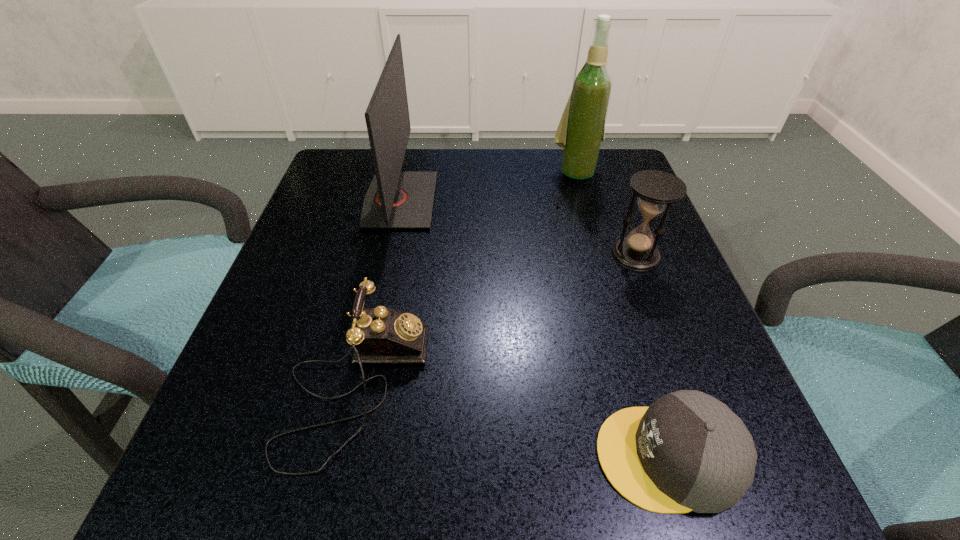
This screenshot has height=540, width=960. I want to click on free space located 0.050m on the front-facing side of the cap, so click(559, 456).

Locate an element on the screen. This screenshot has height=540, width=960. vacant space located 0.140m on the front-facing side of the cap is located at coordinates (489, 456).

This screenshot has height=540, width=960. Identify the location of wine bottle that is at the far edge. (581, 130).

The width and height of the screenshot is (960, 540). Find the location of `monitor that is at the far edge`. monitor that is at the far edge is located at coordinates [396, 199].

The width and height of the screenshot is (960, 540). I want to click on telephone present at the near edge, so click(380, 335).

Where is `cap situated at the near edge`? cap situated at the near edge is located at coordinates (687, 451).

Identify the location of monitor that is at the left edge. (396, 199).

Where is `telephone at the left edge`? The width and height of the screenshot is (960, 540). telephone at the left edge is located at coordinates pos(380,335).

This screenshot has height=540, width=960. I want to click on wine bottle positioned at the right edge, so click(581, 130).

The width and height of the screenshot is (960, 540). I want to click on hourglass located at the right edge, so click(x=656, y=190).